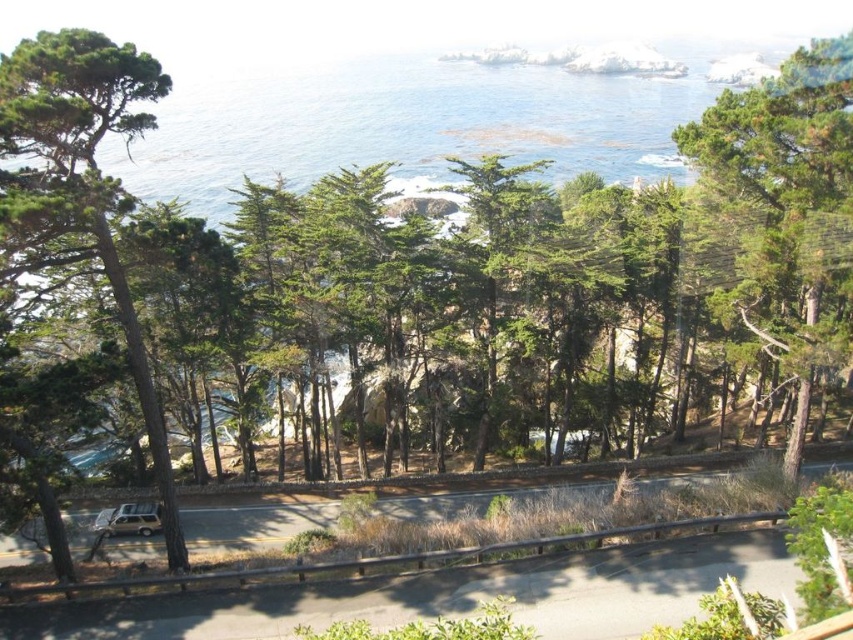
Question: Which point is closer to the camera?

Choices:
 (A) green textured tree at left
 (B) green matte tree at right

Answer: (A)

Question: Can you confirm if green textured tree at left is thinner than gold metallic car at lower left?

Choices:
 (A) yes
 (B) no

Answer: (B)

Question: Estimate the real-world distances between objects in this image. Which object is farther from the green matte tree at right?

Choices:
 (A) green textured tree at left
 (B) gold metallic car at lower left

Answer: (B)

Question: Which point is farther to the camera?

Choices:
 (A) gold metallic car at lower left
 (B) green textured tree at left

Answer: (A)

Question: Is green textured tree at left thinner than gold metallic car at lower left?

Choices:
 (A) no
 (B) yes

Answer: (A)

Question: Can you confirm if green textured tree at left is positioned above gold metallic car at lower left?

Choices:
 (A) no
 (B) yes

Answer: (B)